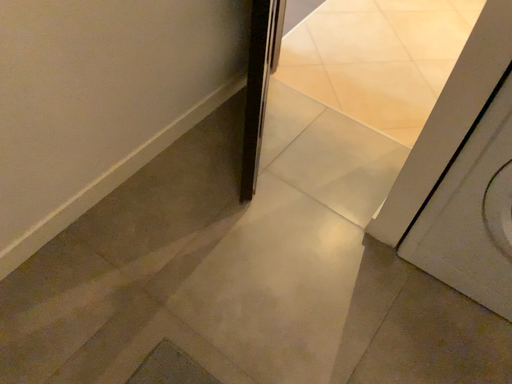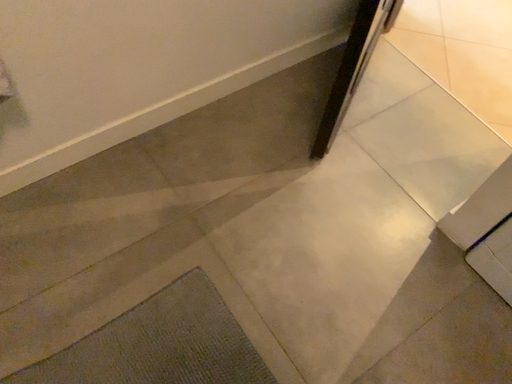
Question: Which way did the camera rotate in the video?

Choices:
 (A) rotated right
 (B) rotated left

Answer: (B)